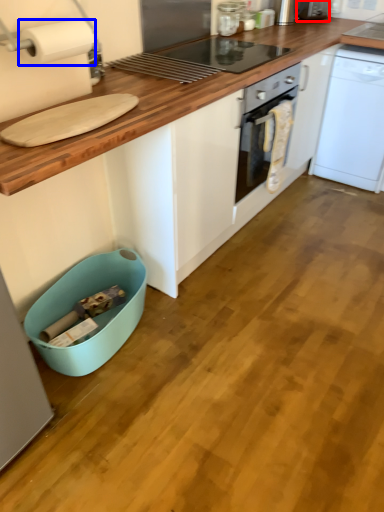
Question: Which object is further to the camera taking this photo, appliance (highlighted by a red box) or paper towel (highlighted by a blue box)?

Choices:
 (A) appliance
 (B) paper towel

Answer: (A)